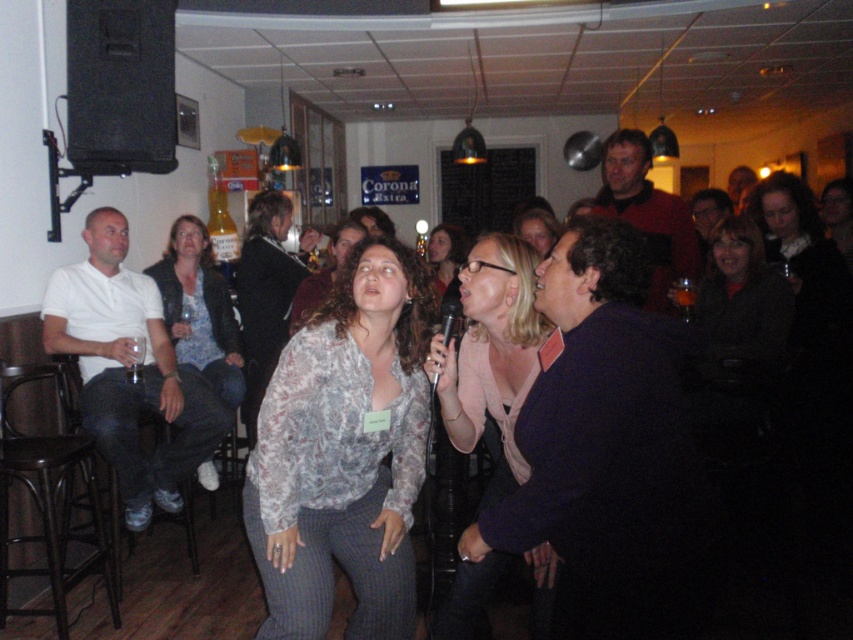
In the scene shown: You are a stagehand setting up a new microphone stand. The stand needs to be placed exactly halfway between the patterned fabric blouse at center and the matte black shirt at center. How far apart should the stand be placed from each object?

The stand should be placed 0.695 meters away from both the patterned fabric blouse at center and the matte black shirt at center since they are 1.39 meters apart. Half of 1.39 meters is approximately 0.695 meters, so the stand should be positioned at that midpoint.

You are standing in the karaoke room and want to move closer to the point at coordinates (338, 461). If you take a step forward of 2 feet, will you be within 5 feet of the point?

The point at coordinates (338, 461) is 6.99 feet away from you. If you take a step forward of 2 feet, your new distance will be 6.99 minus 2 equals 4.99 feet, which is less than 5 feet. Therefore, you will be within 5 feet of the point.